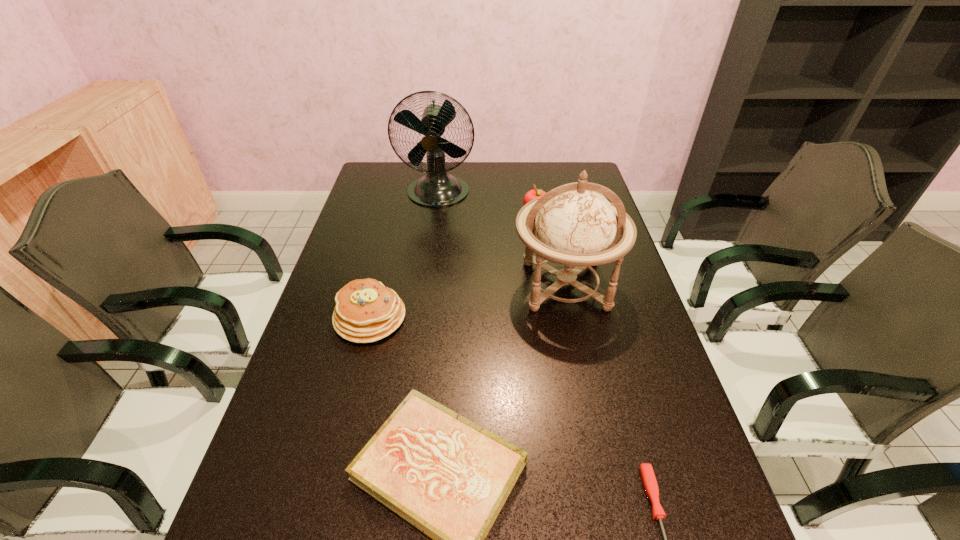
The width and height of the screenshot is (960, 540). I want to click on fan, so click(x=438, y=188).

Image resolution: width=960 pixels, height=540 pixels. I want to click on globe, so 575,225.

At what (x,y) coordinates should I click in order to perform the action: click on apple. Please return your answer as a coordinate pair (x, y). The width and height of the screenshot is (960, 540). Looking at the image, I should click on (535, 193).

I want to click on pancake, so click(366, 311).

Locate an element on the screen. vacant space located 0.110m on the front-facing side of the fan is located at coordinates (433, 233).

You are a GUI agent. You are given a task and a screenshot of the screen. Output one action in this format:
    pyautogui.click(x=<x>, y=<y>)
    Task: Click on the free space located 0.050m on the front-facing side of the globe
    Image resolution: width=960 pixels, height=540 pixels.
    Given the screenshot: What is the action you would take?
    pyautogui.click(x=577, y=340)

Where is `blank area located 0.190m on the back of the apple`? blank area located 0.190m on the back of the apple is located at coordinates (530, 178).

The height and width of the screenshot is (540, 960). What are the coordinates of `free space located 0.120m on the right of the pancake` in the screenshot? It's located at (451, 318).

Identify the location of object located at the far edge. (438, 188).

The height and width of the screenshot is (540, 960). Find the location of `fan that is at the left edge`. fan that is at the left edge is located at coordinates (438, 188).